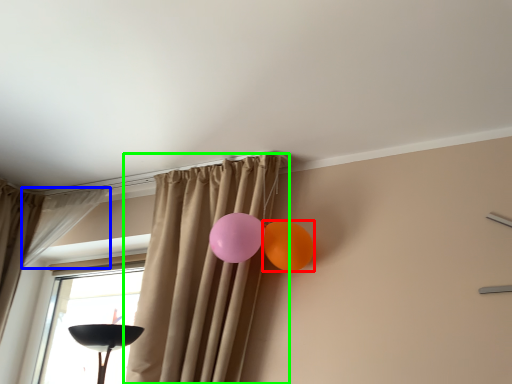
Question: Which object is positioned farthest from balloon (highlighted by a red box)? Select from curtain (highlighted by a blue box) and curtain (highlighted by a green box).

Choices:
 (A) curtain
 (B) curtain

Answer: (A)